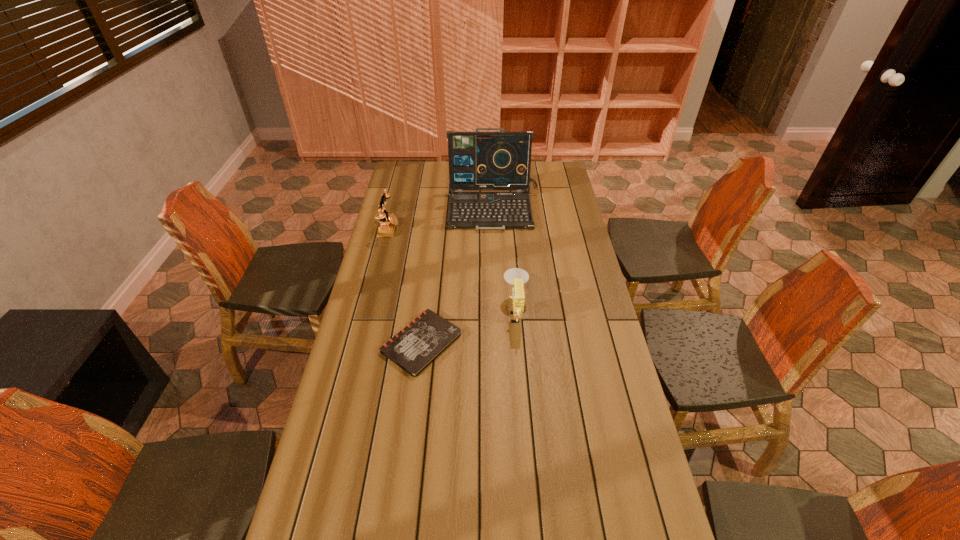
Find the location of a particular element. telephone that is positioned at the left edge is located at coordinates (386, 228).

Find the location of `notebook positioned at the left edge`. notebook positioned at the left edge is located at coordinates (426, 337).

You are a GUI agent. You are given a task and a screenshot of the screen. Output one action in this format:
    pyautogui.click(x=<x>, y=<y>)
    Task: Click on the free space at the left edge
    
    Given the screenshot: What is the action you would take?
    pyautogui.click(x=304, y=522)

Identify the location of vacant region at the right edge. (540, 188).

In the image, there is a desktop. Where is `blank space at the far right corner`? The image size is (960, 540). blank space at the far right corner is located at coordinates (564, 174).

You are a GUI agent. You are given a task and a screenshot of the screen. Output one action in this format:
    pyautogui.click(x=<x>, y=<y>)
    Task: Click on the free area in between the laptop computer and the shortest object
    
    Given the screenshot: What is the action you would take?
    pyautogui.click(x=458, y=275)

Identify the location of free space between the telephone and the sponge. The height and width of the screenshot is (540, 960). (452, 269).

Locate an element on the screen. free space between the telephone and the laptop computer is located at coordinates (442, 218).

The height and width of the screenshot is (540, 960). Identify the location of vacant point located between the sponge and the shortest object. (468, 327).

Locate an element on the screen. The image size is (960, 540). free area in between the shortest object and the sponge is located at coordinates (468, 327).